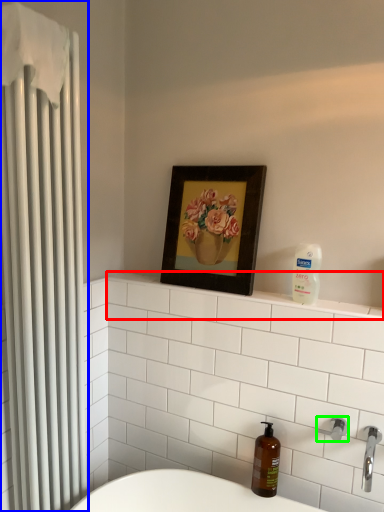
Question: Considering the real-world distances, which object is farthest from balustrade (highlighted by a red box)? shower curtain (highlighted by a blue box) or shower (highlighted by a green box)?

Choices:
 (A) shower curtain
 (B) shower

Answer: (A)